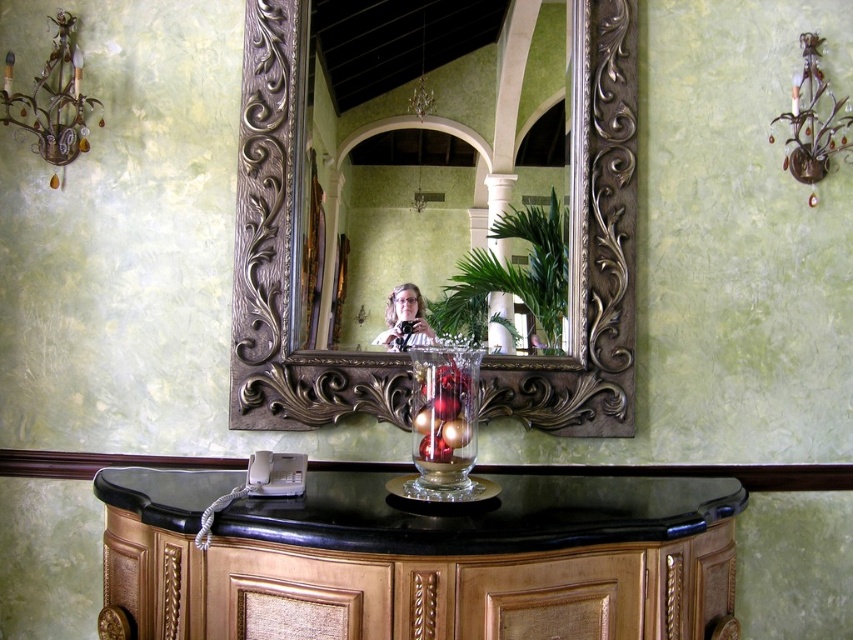
Question: Which point is closer to the camera taking this photo?

Choices:
 (A) (350, 205)
 (B) (399, 294)
 (C) (602, 604)

Answer: (C)

Question: Does black marble vanity at lower center appear over gold ornate mirror at center?

Choices:
 (A) yes
 (B) no

Answer: (B)

Question: Which point is closer to the camera taking this photo?

Choices:
 (A) (331, 586)
 (B) (419, 324)

Answer: (A)

Question: Does black marble vanity at lower center appear on the right side of gold ornate mirror at center?

Choices:
 (A) yes
 (B) no

Answer: (B)

Question: Estimate the real-world distances between objects in this image. Which object is farther from the matte black camera at center?

Choices:
 (A) black marble vanity at lower center
 (B) gold ornate mirror at center

Answer: (A)

Question: Can you confirm if black marble vanity at lower center is positioned below gold ornate mirror at center?

Choices:
 (A) yes
 (B) no

Answer: (A)